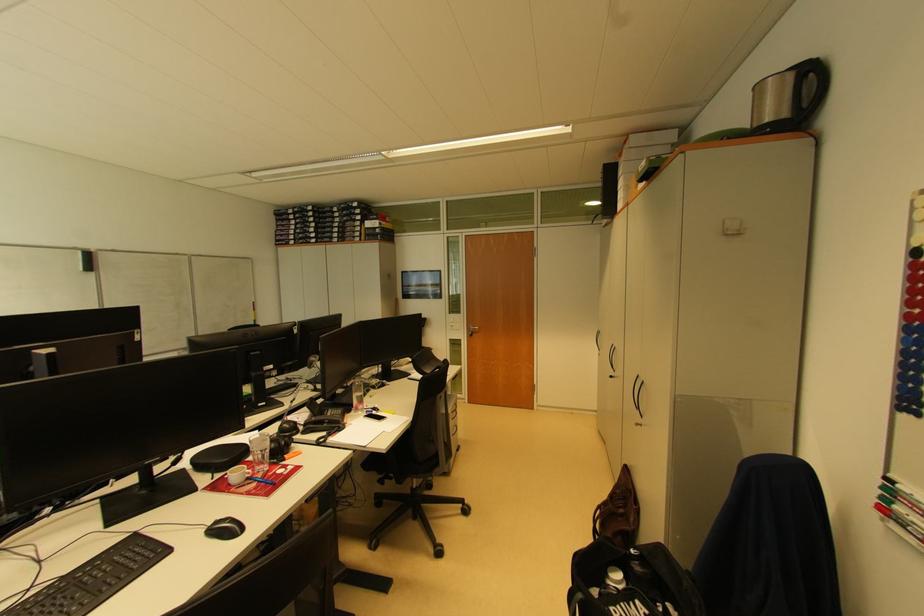
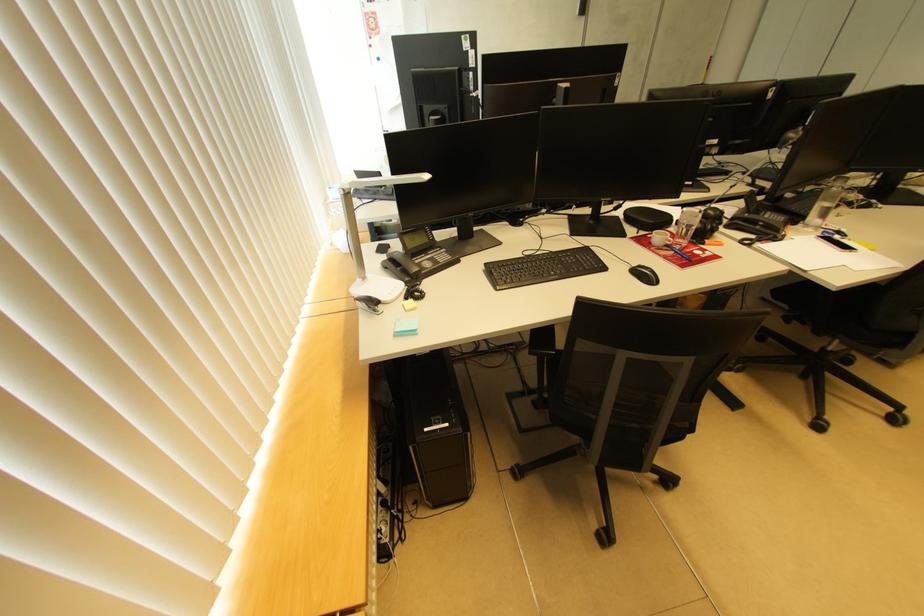
The first image is from the beginning of the video and the second image is from the end. How did the camera likely rotate when shooting the video?

The camera rotated toward left-down.